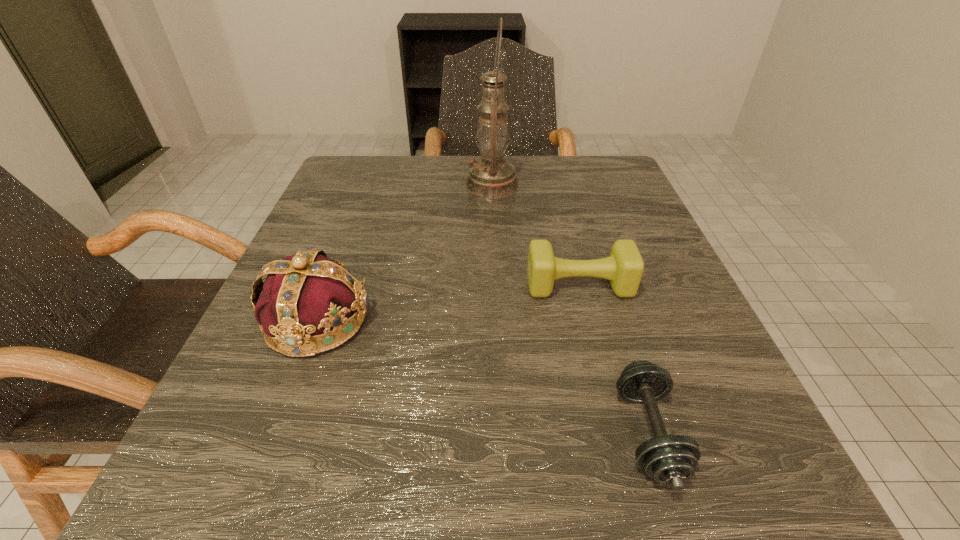
Identify the location of object positioned at the far edge. (491, 176).

Find the location of `object situated at the near edge`. object situated at the near edge is located at coordinates (672, 459).

You are a GUI agent. You are given a task and a screenshot of the screen. Output one action in this format:
    pyautogui.click(x=<x>, y=<y>)
    Task: Click on the object at the left edge
    
    Given the screenshot: What is the action you would take?
    pyautogui.click(x=303, y=295)

Where is `object that is at the near right corner`? This screenshot has height=540, width=960. object that is at the near right corner is located at coordinates point(672,459).

In the image, there is a desktop. At what (x,y) coordinates should I click in order to perform the action: click on vacant area at the far edge. Please return your answer as a coordinate pair (x, y). Image resolution: width=960 pixels, height=540 pixels. Looking at the image, I should click on (462, 154).

Where is `vacant region at the near edge`? The height and width of the screenshot is (540, 960). vacant region at the near edge is located at coordinates (558, 460).

Where is `vacant area at the left edge`? Image resolution: width=960 pixels, height=540 pixels. vacant area at the left edge is located at coordinates (x=339, y=241).

Find the location of a particular element. This screenshot has width=960, height=540. vacant space at the right edge of the desktop is located at coordinates (578, 227).

The height and width of the screenshot is (540, 960). In the image, there is a desktop. What are the coordinates of `vacant space at the far left corner` in the screenshot? It's located at (360, 197).

Locate an element on the screen. vacant space at the far right corner of the desktop is located at coordinates (564, 178).